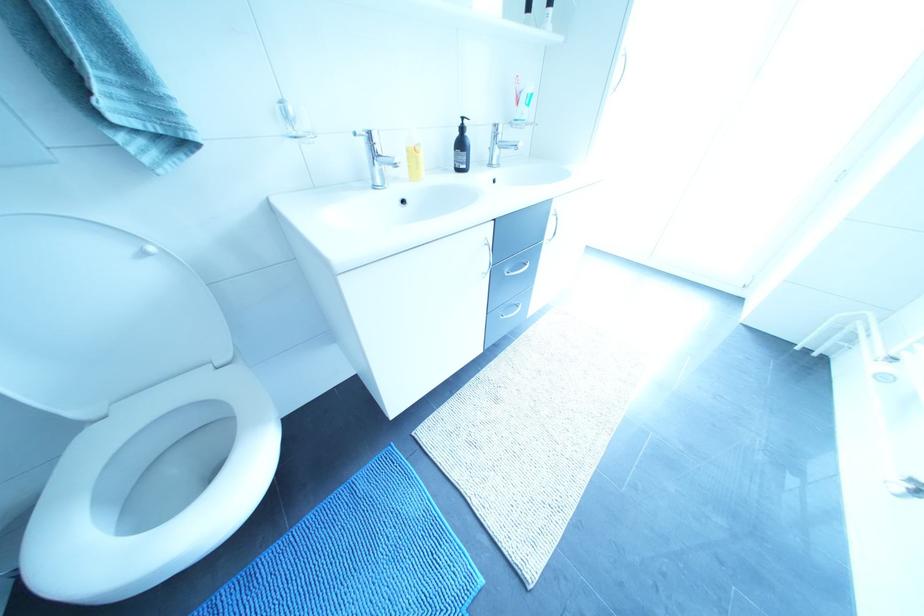
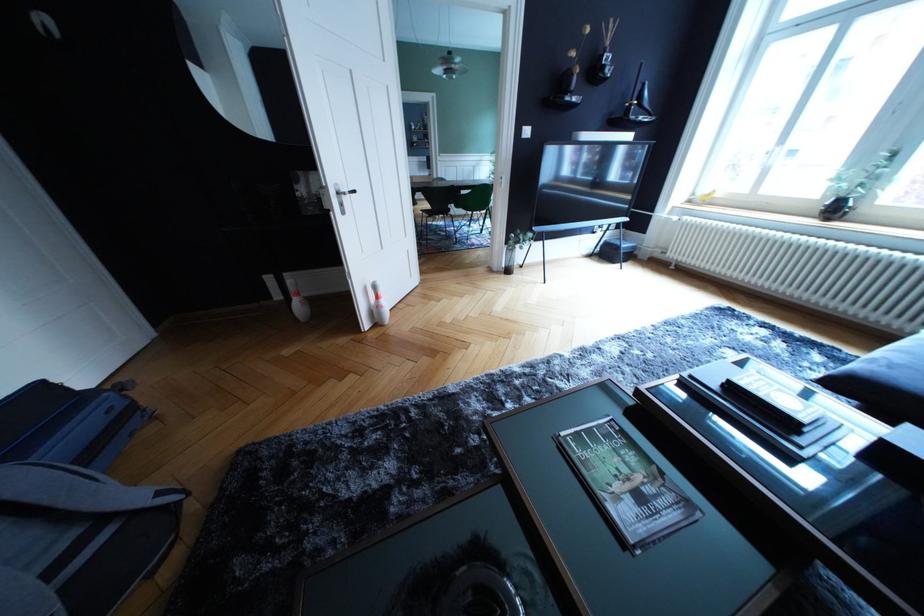
Question: I am providing you with two images of the same scene from different viewpoints. After the viewpoint changes to image2, which objects are now occluded?

Choices:
 (A) yellow soap bottle
 (B) toilet paper piece
 (C) glass vase
 (D) white light switch

Answer: (A)